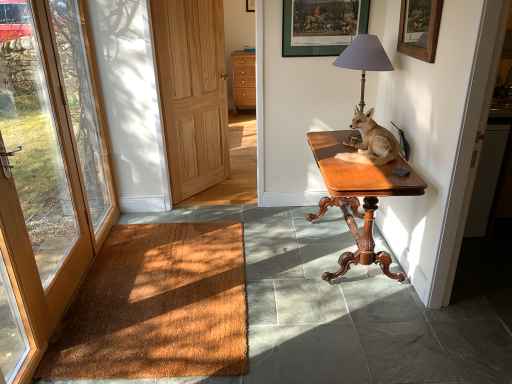
The image size is (512, 384). Find the location of `free region under mahogany wood desk at right (from a real-world perspective)`. free region under mahogany wood desk at right (from a real-world perspective) is located at coordinates (343, 252).